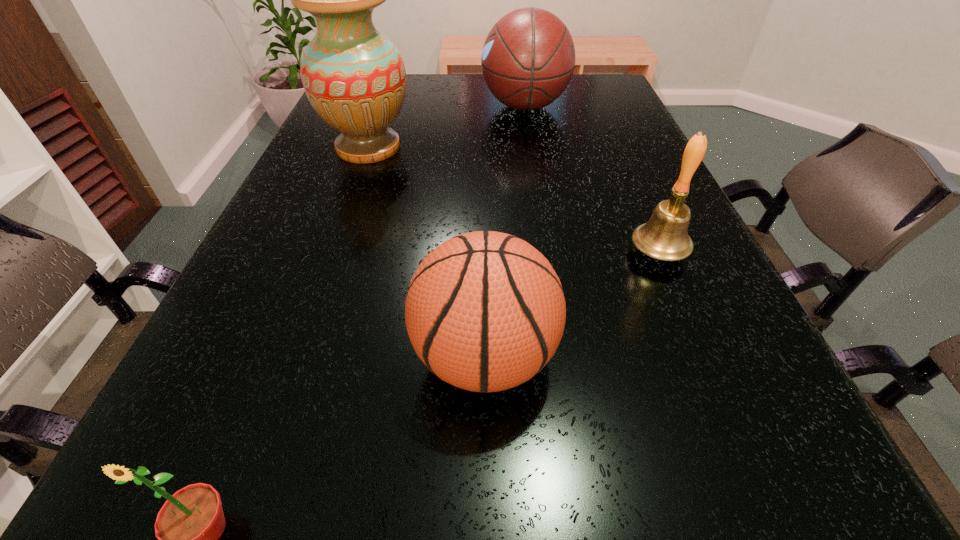
Identify the location of free space that satisfies the following two spatial constraints: 1. on the front side of the third farthest object; 2. on the side where the inflation valve is located. (703, 357).

At what (x,y) coordinates should I click in order to perform the action: click on free spot that satisfies the following two spatial constraints: 1. on the front side of the bell; 2. on the side where the inflation valve is located. Please return your answer as a coordinate pair (x, y). This screenshot has width=960, height=540. Looking at the image, I should click on (x=703, y=357).